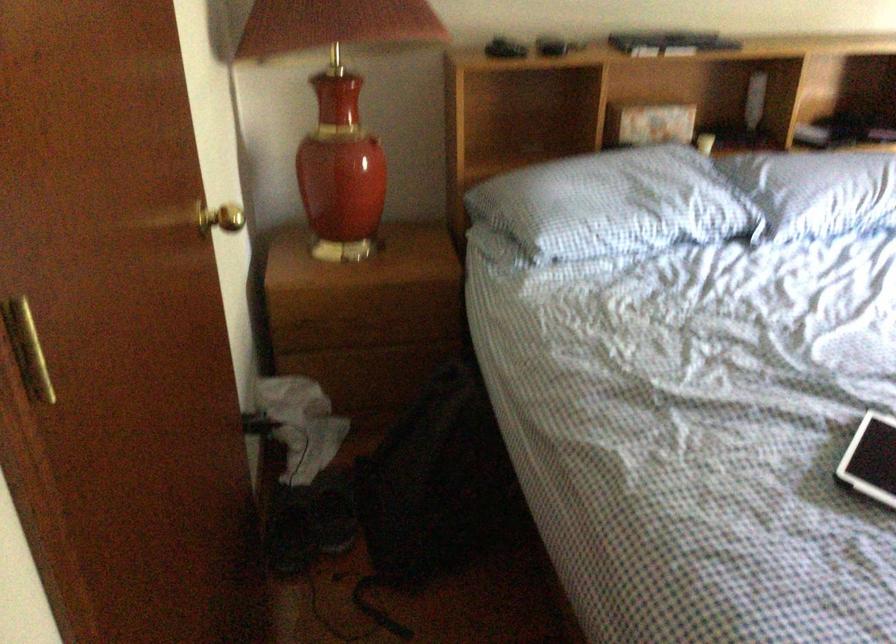
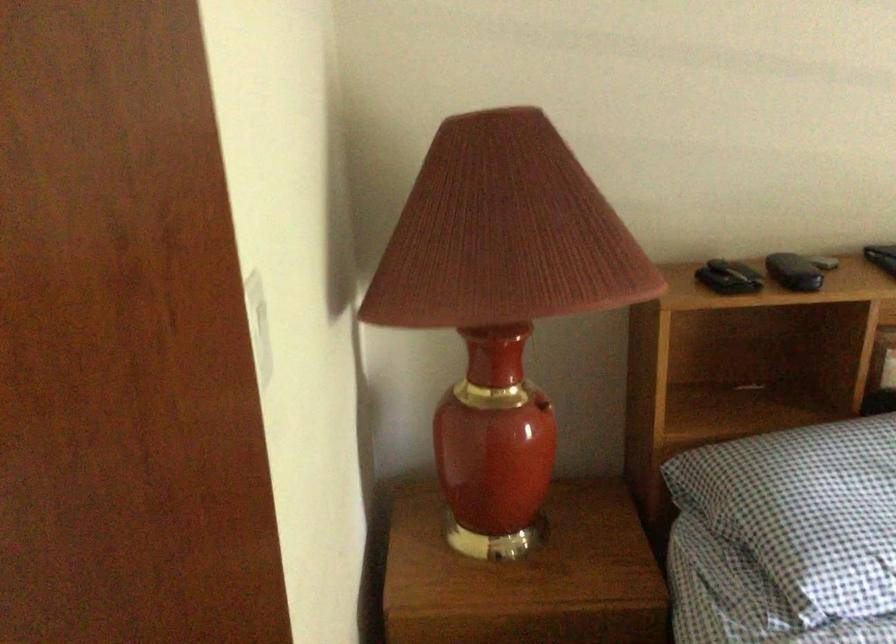
The images are taken continuously from a first-person perspective. In which direction are you moving?

The movement direction of the cameraman is left, forward.